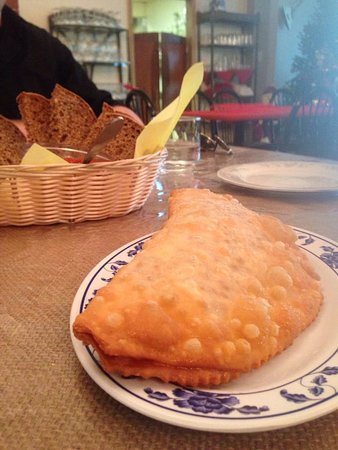
At what (x,y) coordinates should I click in order to perform the action: click on glass. Please return your answer as a coordinate pair (x, y). Image resolution: width=338 pixels, height=450 pixels. Looking at the image, I should click on (175, 153), (225, 37), (242, 35), (235, 38), (219, 38), (253, 38).